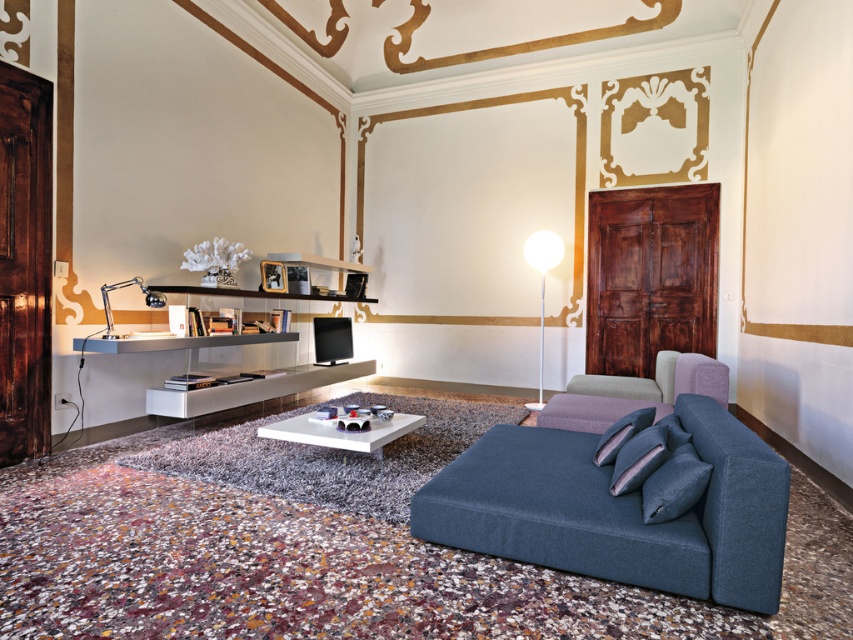
Question: Does white glossy coffee table at center have a lesser width compared to white glossy floor lamp at center?

Choices:
 (A) yes
 (B) no

Answer: (B)

Question: Which object appears closest to the camera in this image?

Choices:
 (A) white glossy floor lamp at center
 (B) white glossy coffee table at center

Answer: (B)

Question: Is the position of gray fabric armchair at right less distant than that of chrome metallic desk lamp at left?

Choices:
 (A) no
 (B) yes

Answer: (B)

Question: Which point is farther to the camera?

Choices:
 (A) (682, 394)
 (B) (576, 403)
 (C) (538, 371)

Answer: (C)

Question: Which point is farther from the camera taking this photo?

Choices:
 (A) (672, 392)
 (B) (138, 284)
 (C) (370, 426)
 (D) (543, 269)

Answer: (D)

Question: Is velvet blue couch at lower right thinner than white glossy floor lamp at center?

Choices:
 (A) no
 (B) yes

Answer: (A)